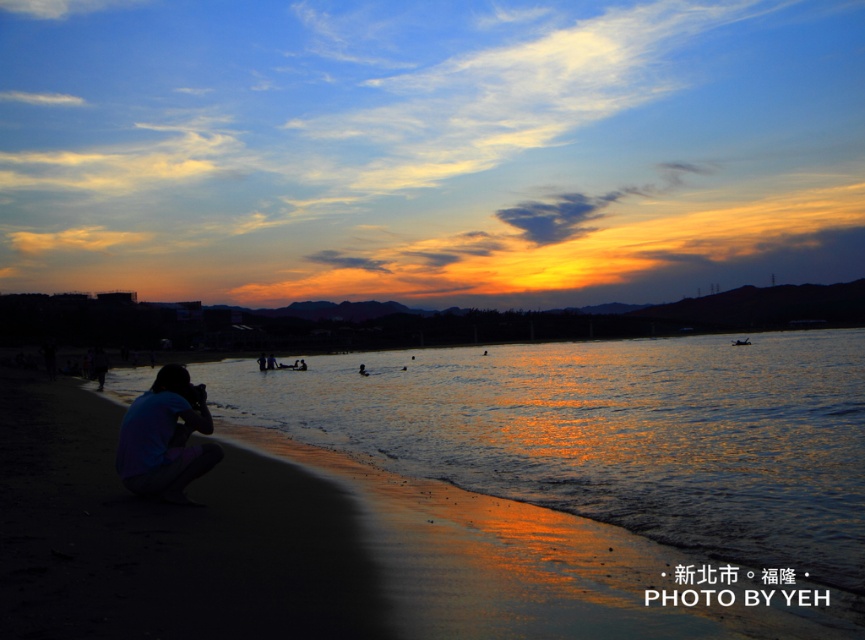
Identify the location of glistening water at lower left. (612, 433).

Which is behind, point (802, 445) or point (133, 456)?

The point (802, 445) is behind.

Where is `glistening water at lower left`? This screenshot has height=640, width=865. glistening water at lower left is located at coordinates (612, 433).